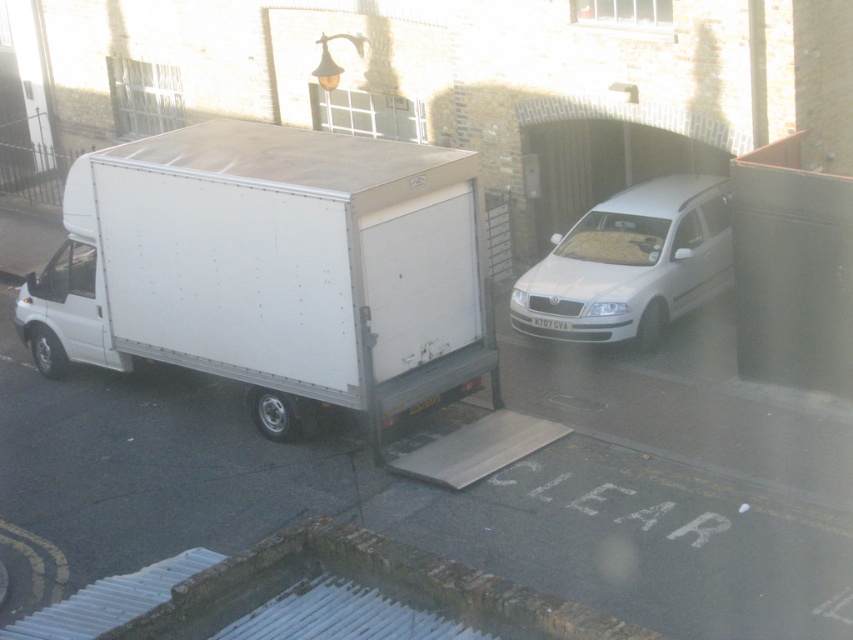
Question: Which of these objects is positioned closest to the white plastic license plate at center?

Choices:
 (A) white matte truck at left
 (B) white matte van at center

Answer: (B)

Question: Is white matte truck at left further to the viewer compared to white matte van at center?

Choices:
 (A) no
 (B) yes

Answer: (A)

Question: Which of the following is the farthest from the observer?

Choices:
 (A) white matte van at center
 (B) white matte truck at left

Answer: (A)

Question: Does white matte truck at left have a smaller size compared to white plastic license plate at center?

Choices:
 (A) yes
 (B) no

Answer: (B)

Question: Can you confirm if white matte truck at left is positioned below white plastic license plate at center?

Choices:
 (A) no
 (B) yes

Answer: (B)

Question: Estimate the real-world distances between objects in this image. Which object is farther from the white plastic license plate at center?

Choices:
 (A) white matte van at center
 (B) white matte truck at left

Answer: (B)